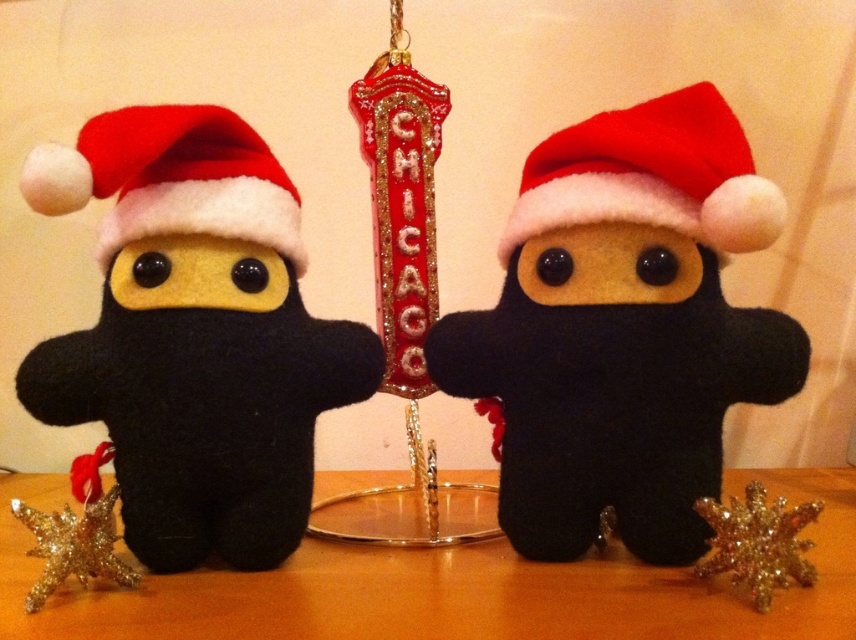
Is wooden table at center further to camera compared to shiny metallic star at lower left?

No.

Does point (52, 621) lie behind point (43, 525)?

That is False.

The height and width of the screenshot is (640, 856). In order to click on wooden table at center in this screenshot , I will do `click(443, 588)`.

Who is more distant from viewer, (574, 339) or (193, 372)?

The point (574, 339) is behind.

In the scene shown: Is matte black ninja at center below matte black ninja at left?

Actually, matte black ninja at center is above matte black ninja at left.

Is point (528, 205) behind point (271, 538)?

Yes, point (528, 205) is behind point (271, 538).

Image resolution: width=856 pixels, height=640 pixels. I want to click on matte black ninja at center, so click(623, 328).

Can you confirm if felt santa hat at center is taller than gold glitter star at lower right?

Yes, felt santa hat at center is taller than gold glitter star at lower right.

Can you confirm if felt santa hat at center is wider than gold glitter star at lower right?

Yes.

Locate an element on the screen. felt santa hat at center is located at coordinates (651, 176).